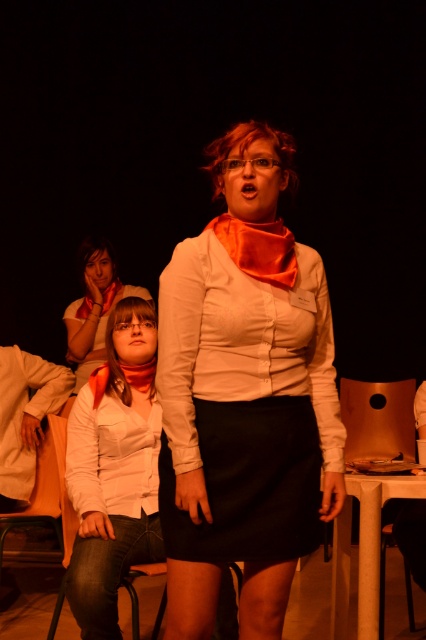
You are an observer in the scene. You see the matte white scarf at upper left and the orange matte scarf at upper center. Which scarf is nearer to you?

The matte white scarf at upper left is closer to the viewer than the orange matte scarf at upper center.

You are organizing a photo shoot and need to arrange two scarves in a display. The scene shows a matte white scarf at upper left and an orange matte scarf at upper center. Which scarf should you place higher up in your display to match the original image?

The matte white scarf at upper left should be placed higher up in the display since it is taller than the orange matte scarf at upper center in the original image.

You are organizing a photo shoot and need to position two white items in the scene. The items are the white cotton shirt at lower left and the matte white scarf at upper left. According to the scene description, which item is positioned to the left of the other?

The white cotton shirt at lower left is positioned to the left of matte white scarf at upper left.